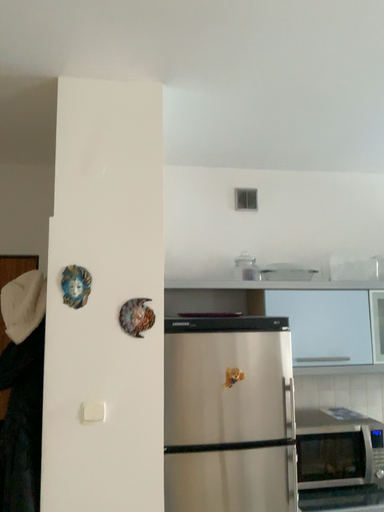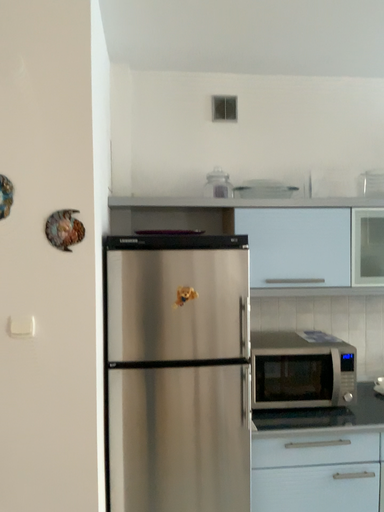
Question: Which way did the camera rotate in the video?

Choices:
 (A) rotated upward
 (B) rotated downward

Answer: (B)